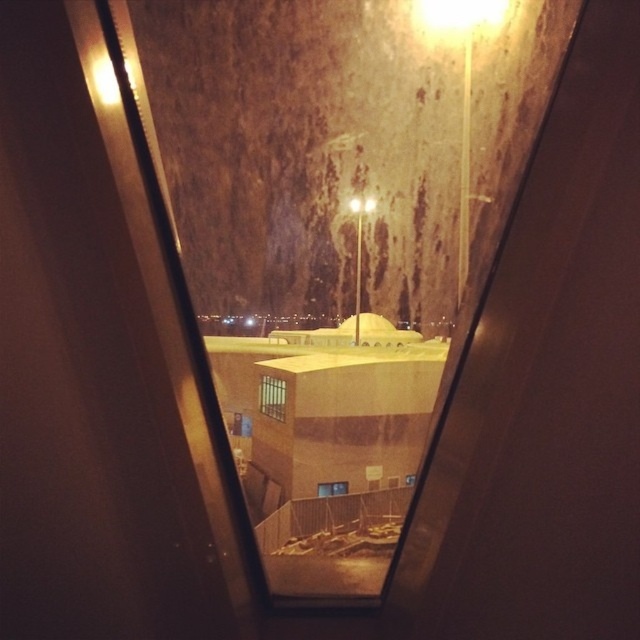
Who is positioned more to the right, clear glass window at center or transparent glass window at center?

transparent glass window at center

Who is higher up, clear glass window at center or transparent glass window at center?

clear glass window at center is higher up.

Does point (284, 394) lie in front of point (348, 490)?

Yes, point (284, 394) is in front of point (348, 490).

Locate an element on the screen. clear glass window at center is located at coordinates (273, 396).